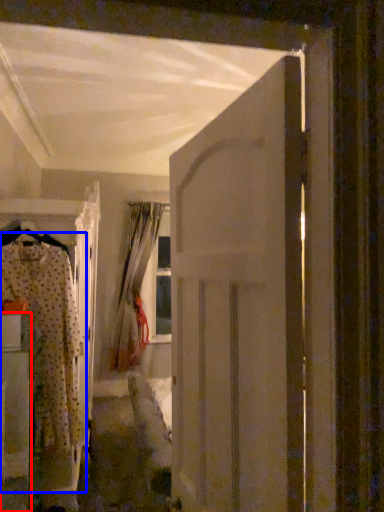
Question: Which object is further to the camera taking this photo, furniture (highlighted by a red box) or clothing (highlighted by a blue box)?

Choices:
 (A) furniture
 (B) clothing

Answer: (B)